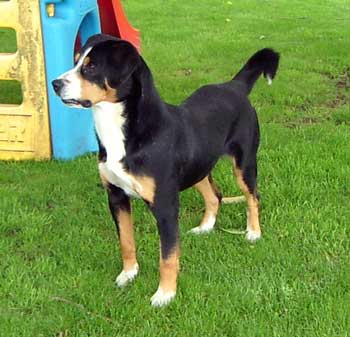
This screenshot has width=350, height=337. I want to click on blue plastic piece of children's toy, so click(64, 35).